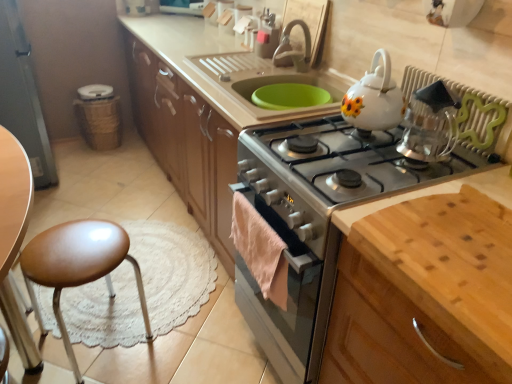
You are a GUI agent. You are given a task and a screenshot of the screen. Output one action in this format:
    pyautogui.click(x=<x>, y=<y>)
    Task: Click on the vacant area on the back side of brown leather stool at lower left
    This screenshot has height=384, width=512.
    Given the screenshot: What is the action you would take?
    pyautogui.click(x=140, y=278)